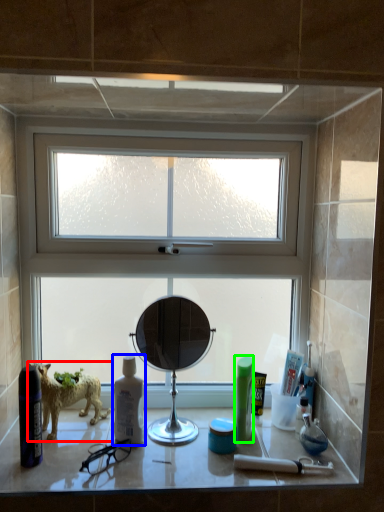
Question: Which is nearer to the dog (highlighted by a red box)? mouthwash (highlighted by a blue box) or toiletry (highlighted by a green box).

Choices:
 (A) mouthwash
 (B) toiletry

Answer: (A)